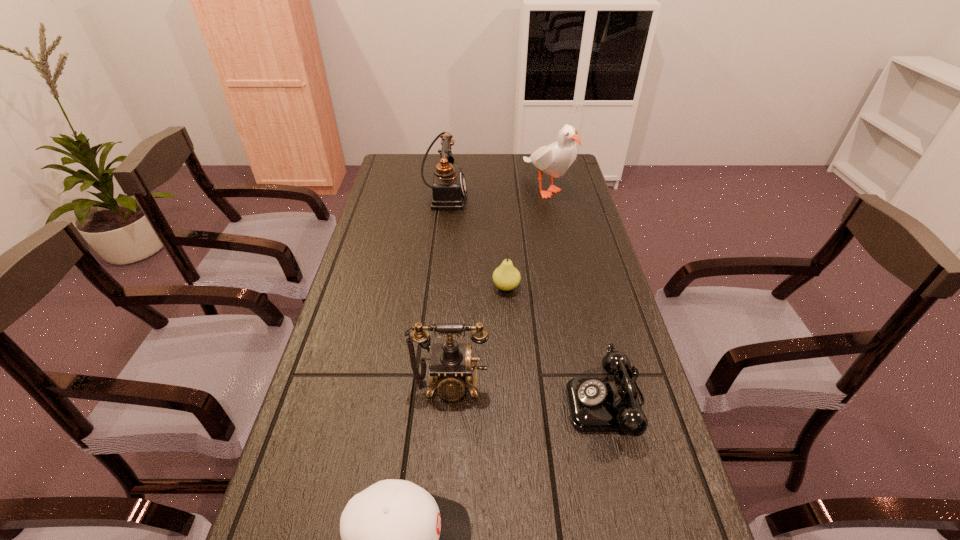
In order to click on vacant space located on the dial of the rightmost telephone in this screenshot , I will do `click(443, 403)`.

This screenshot has width=960, height=540. What are the coordinates of `gull present at the far edge` in the screenshot? It's located at (554, 159).

Image resolution: width=960 pixels, height=540 pixels. In order to click on telephone that is at the far edge in this screenshot , I will do `click(449, 188)`.

The image size is (960, 540). In order to click on gull present at the right edge in this screenshot , I will do `click(554, 159)`.

I want to click on telephone situated at the right edge, so pos(595,404).

At what (x,y) coordinates should I click in order to perform the action: click on object that is at the far right corner. Please return your answer as a coordinate pair (x, y). This screenshot has width=960, height=540. Looking at the image, I should click on (554, 159).

Image resolution: width=960 pixels, height=540 pixels. What are the coordinates of `free space at the far edge of the desktop` in the screenshot? It's located at (437, 154).

The width and height of the screenshot is (960, 540). In order to click on vacant space at the left edge of the desktop in this screenshot , I will do `click(368, 456)`.

The width and height of the screenshot is (960, 540). I want to click on free region at the right edge of the desktop, so point(672,515).

This screenshot has height=540, width=960. Find the location of `vacant region at the far left corner of the desktop`. vacant region at the far left corner of the desktop is located at coordinates (392, 167).